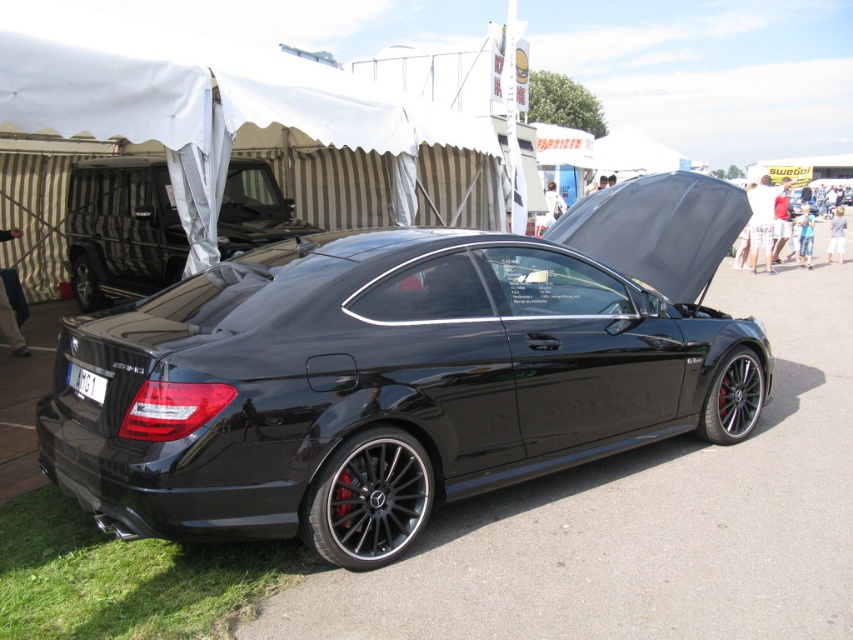
You are a photographer standing at the event area. You want to take a photo of the glossy black car at center from a distance that allows you to capture the entire car without cropping. If your camera has a maximum zoom range of 2.5 meters, will you be able to capture the entire car in one shot?

The glossy black car at center is 3.02 meters away from the viewer. Since the camera can only zoom up to 2.5 meters, the photographer will not be able to capture the entire car in one shot without cropping.